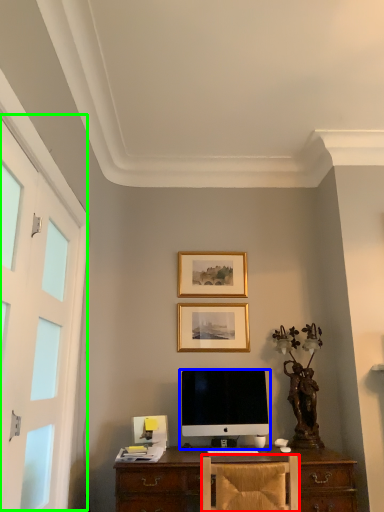
Question: Based on their relative distances, which object is farther from chair (highlighted by a red box)? Choose from computer monitor (highlighted by a blue box) and screen door (highlighted by a green box).

Choices:
 (A) computer monitor
 (B) screen door

Answer: (B)